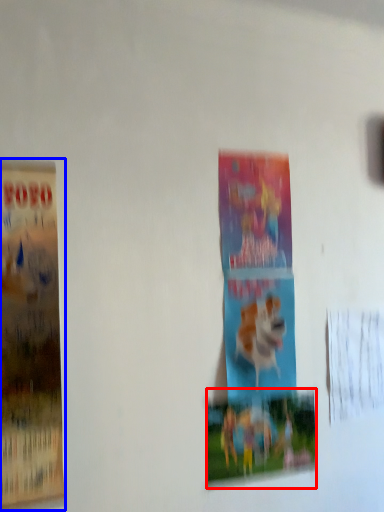
Question: Which object is closer to the camera taking this photo, poster (highlighted by a red box) or poster (highlighted by a blue box)?

Choices:
 (A) poster
 (B) poster

Answer: (B)